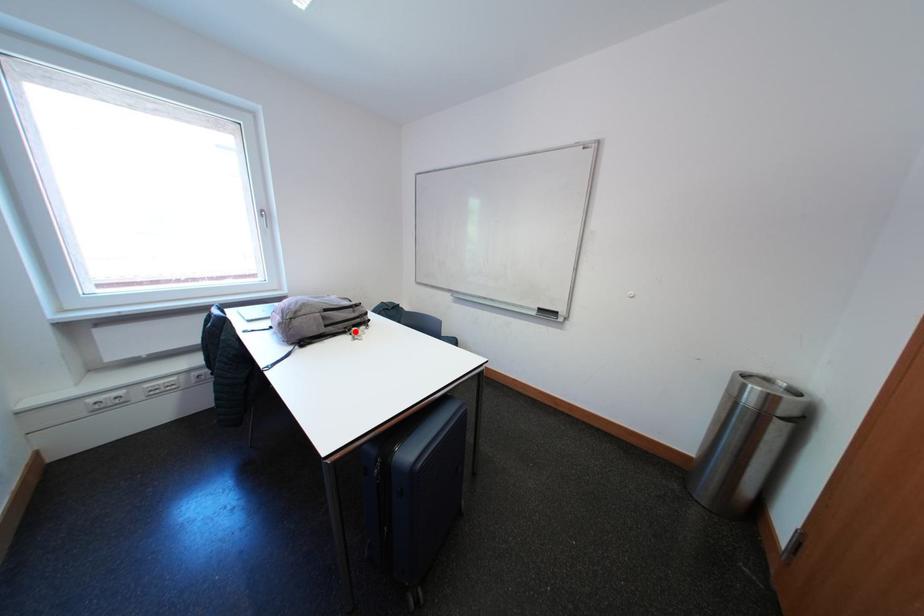
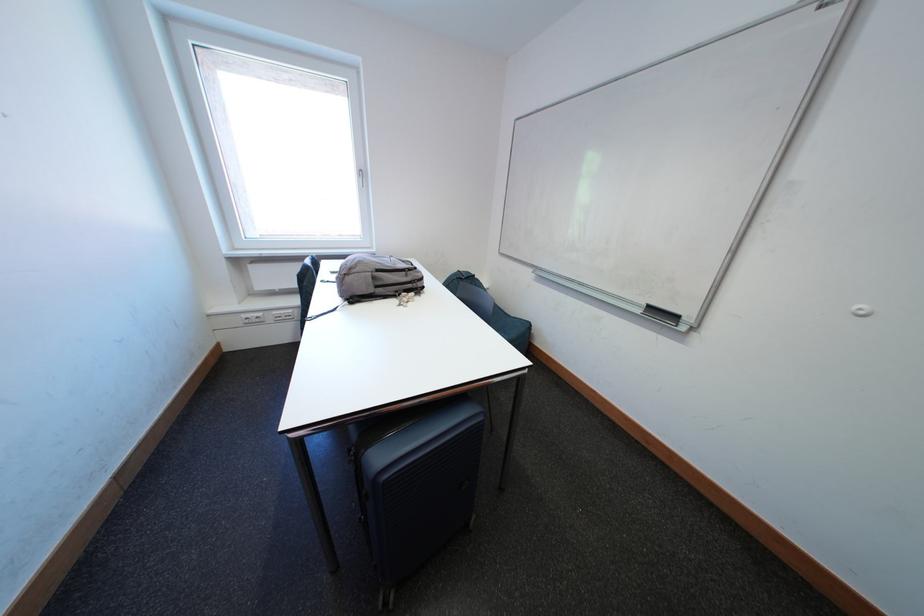
Find the pixel in the second image that matches the highlighted location in the first image.

(406, 294)